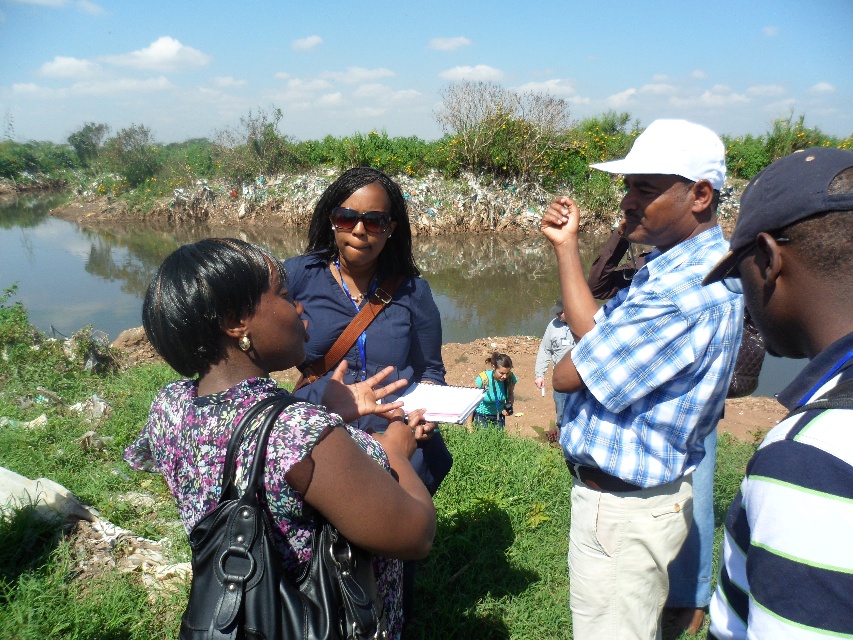
You are a photographer standing 10 feet away from the two men in the image. You want to take a photo that includes both the blue plaid shirt at center and the matte blue shirt at center in the same frame. Given that your camera has a maximum field of view of 25 inches, will you be able to capture both subjects in one shot?

The distance between the blue plaid shirt at center and the matte blue shirt at center is 26.23 inches. Since your camera has a maximum field of view of 25 inches, you will not be able to capture both subjects in one shot without moving closer.

You are standing at the camera position and see two points in the image. Which point is closer to you, point (x=292, y=310) or point (x=842, y=227)?

Point (x=292, y=310) is closer to you because it is further to the camera than point (x=842, y=227).